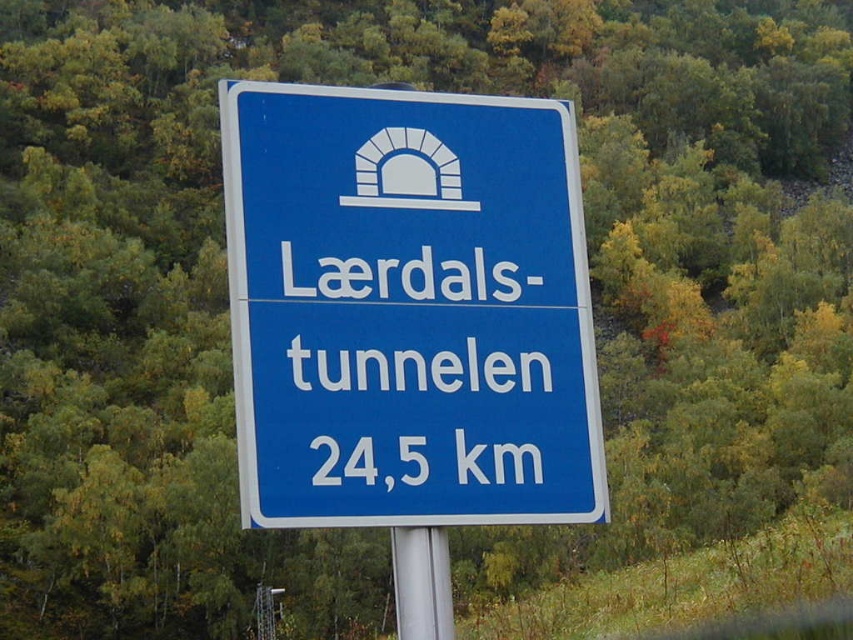
Locate an element on the screen. The height and width of the screenshot is (640, 853). blue plastic sign at center is located at coordinates (408, 308).

Is the position of blue plastic sign at center more distant than that of silver metallic pole at center?

No, blue plastic sign at center is closer to the viewer.

Who is more distant from viewer, (x=531, y=400) or (x=425, y=560)?

The point (x=531, y=400) is more distant.

Find the location of a particular element. blue plastic sign at center is located at coordinates (408, 308).